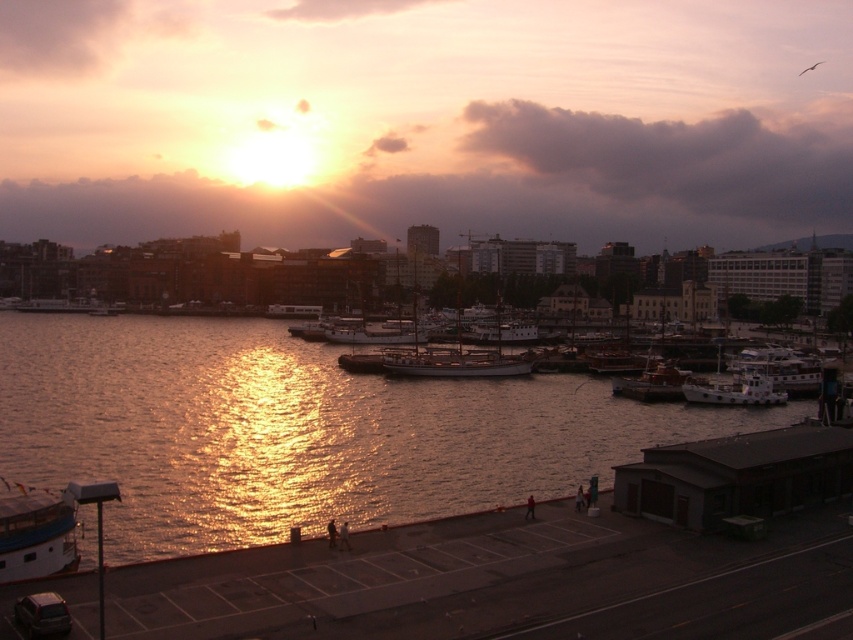
Can you confirm if smooth concrete dock at lower center is smaller than white wooden boat at center right?

No, smooth concrete dock at lower center is not smaller than white wooden boat at center right.

Between smooth concrete dock at lower center and white wooden boat at center right, which one is positioned lower?

Positioned lower is smooth concrete dock at lower center.

Between point (233, 620) and point (811, 376), which one is positioned behind?

The point (811, 376) is behind.

At what (x,y) coordinates should I click in order to perform the action: click on smooth concrete dock at lower center. Please return your answer as a coordinate pair (x, y). The image size is (853, 640). Looking at the image, I should click on (544, 563).

Between wooden boat at lower right and white matte boat at lower right, which one is positioned lower?

white matte boat at lower right

The height and width of the screenshot is (640, 853). Identify the location of wooden boat at lower right. (654, 381).

This screenshot has height=640, width=853. In order to click on wooden boat at lower right in this screenshot , I will do `click(654, 381)`.

Between smooth concrete dock at lower center and white glossy boat at lower left, which one has less height?

Standing shorter between the two is white glossy boat at lower left.

Does smooth concrete dock at lower center have a lesser width compared to white glossy boat at lower left?

No.

What are the coordinates of `smooth concrete dock at lower center` in the screenshot? It's located at (544, 563).